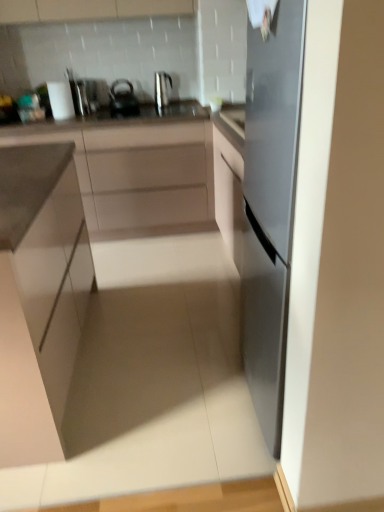
Question: From a real-world perspective, is metallic silver kettle at upper center positioned under white matte cabinet at center, which is the second cabinetry in front-to-back order, based on gravity?

Choices:
 (A) yes
 (B) no

Answer: (B)

Question: Is metallic silver kettle at upper center positioned beyond the bounds of white matte cabinet at center, which is the first cabinetry from back to front?

Choices:
 (A) yes
 (B) no

Answer: (A)

Question: Does metallic silver kettle at upper center turn towards white matte cabinet at center, which is the first cabinetry from back to front?

Choices:
 (A) yes
 (B) no

Answer: (B)

Question: Can you confirm if metallic silver kettle at upper center is positioned to the left of white matte cabinet at center, which is the first cabinetry from back to front?

Choices:
 (A) yes
 (B) no

Answer: (B)

Question: Is metallic silver kettle at upper center shorter than white matte cabinet at center, which is the second cabinetry in front-to-back order?

Choices:
 (A) no
 (B) yes

Answer: (B)

Question: Is white matte cabinet at center, which is the first cabinetry from back to front, surrounded by metallic silver kettle at upper center?

Choices:
 (A) no
 (B) yes

Answer: (A)

Question: Does metallic silver kettle at upper center have a greater width compared to matte black kettle at upper center?

Choices:
 (A) no
 (B) yes

Answer: (A)

Question: Does metallic silver kettle at upper center contain matte black kettle at upper center?

Choices:
 (A) no
 (B) yes

Answer: (A)

Question: Does metallic silver kettle at upper center have a smaller size compared to matte black kettle at upper center?

Choices:
 (A) yes
 (B) no

Answer: (A)

Question: Is matte black kettle at upper center at the back of metallic silver kettle at upper center?

Choices:
 (A) yes
 (B) no

Answer: (B)

Question: Are metallic silver kettle at upper center and matte black kettle at upper center located far from each other?

Choices:
 (A) yes
 (B) no

Answer: (B)

Question: Can you confirm if metallic silver kettle at upper center is thinner than matte black kettle at upper center?

Choices:
 (A) no
 (B) yes

Answer: (B)

Question: Could you tell me if metallic silver kettle at upper center is facing matte white cabinet at left, the 2th cabinetry when ordered from back to front?

Choices:
 (A) yes
 (B) no

Answer: (B)